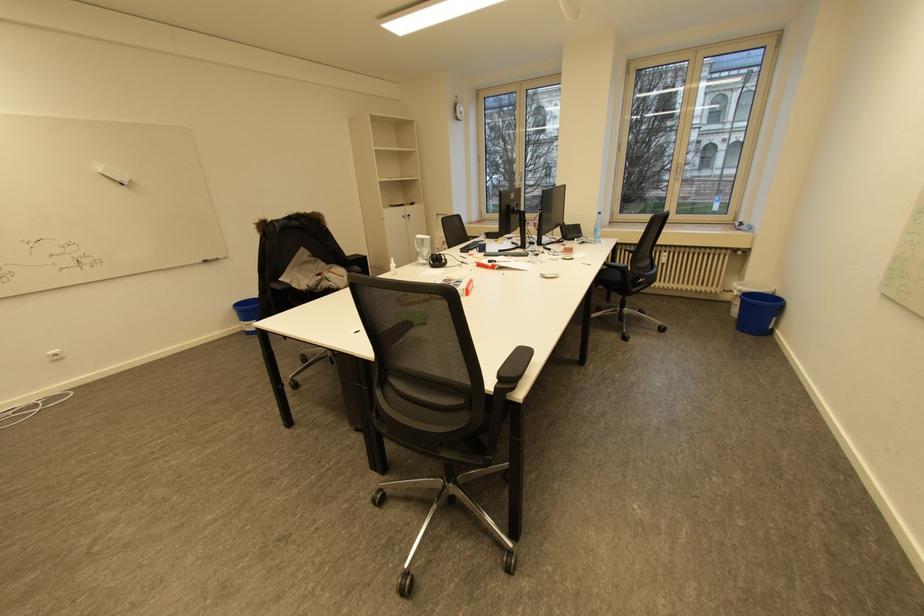
Find where to pull the cabinet door handle. Please return your answer as a coordinate pair (x, y).

(415, 220)